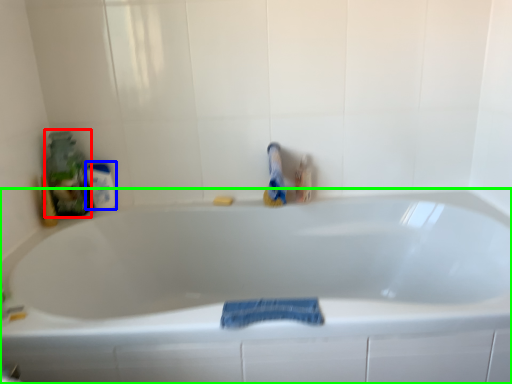
Question: Which is nearer to the cleaning product (highlighted by a red box)? mouthwash (highlighted by a blue box) or bathtub (highlighted by a green box).

Choices:
 (A) mouthwash
 (B) bathtub

Answer: (A)